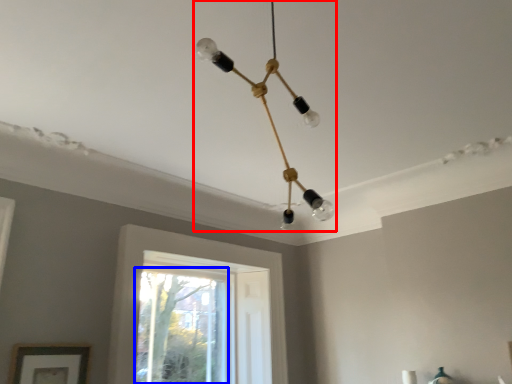
Question: Which object appears farthest to the camera in this image, lamp (highlighted by a red box) or window (highlighted by a blue box)?

Choices:
 (A) lamp
 (B) window

Answer: (B)